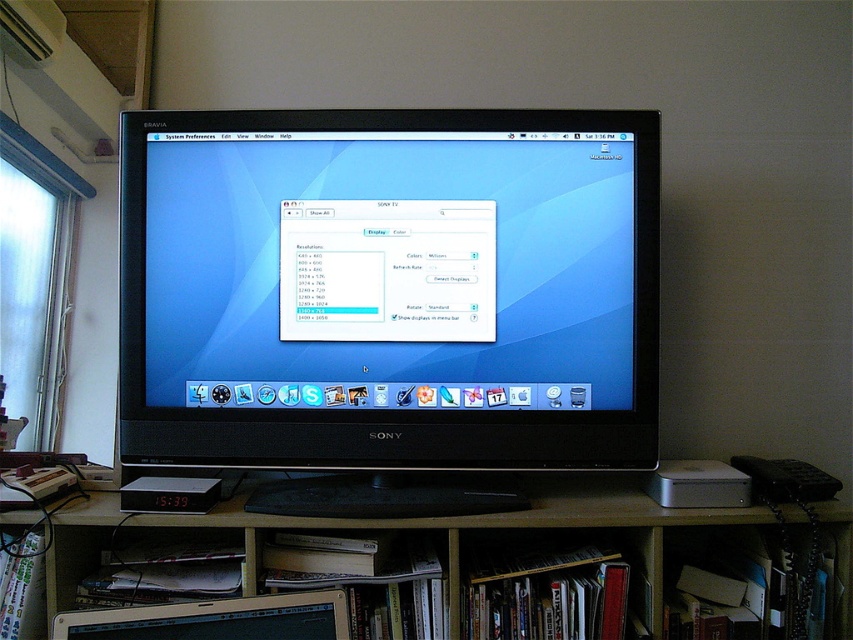
You are standing in front of the black glossy monitor at center and want to reach the dark wood bookshelf at lower center. Which direction should you move to get there?

The dark wood bookshelf at lower center is behind the black glossy monitor at center, so you should move backward to reach it.